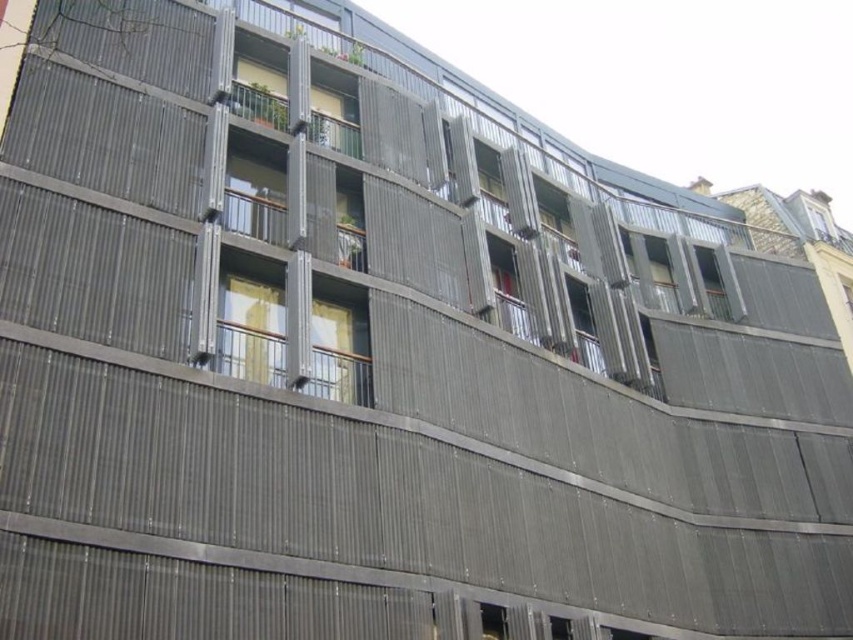
Question: Which point is closer to the camera?

Choices:
 (A) clear glass window at upper right
 (B) white glossy window at center
 (C) transparent glass window at lower center
 (D) matte gray window at upper center

Answer: (C)

Question: Is matte gray window at upper center smaller than white glossy window at center?

Choices:
 (A) no
 (B) yes

Answer: (B)

Question: Which point is closer to the camera taking this photo?

Choices:
 (A) (816, 220)
 (B) (490, 604)
 (C) (846, 282)

Answer: (B)

Question: Considering the relative positions of matte gray window at upper center and clear glass window at upper right in the image provided, where is matte gray window at upper center located with respect to clear glass window at upper right?

Choices:
 (A) below
 (B) above

Answer: (B)

Question: Can you confirm if clear glass window at upper right is smaller than white glossy window at center?

Choices:
 (A) no
 (B) yes

Answer: (A)

Question: Which of the following is the closest to the observer?

Choices:
 (A) coord(503,625)
 (B) coord(254,88)
 (C) coord(842,292)

Answer: (A)